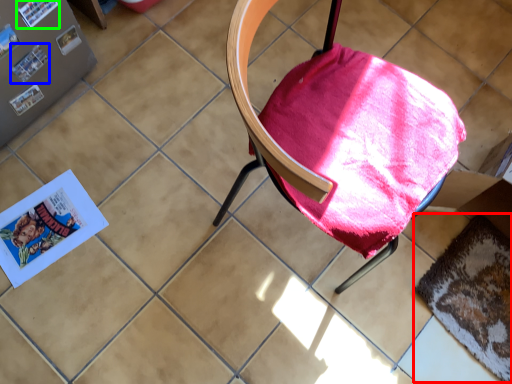
Question: Which object is the farthest from mat (highlighted by a red box)? Choose among these: paperback book (highlighted by a blue box) or paperback book (highlighted by a green box).

Choices:
 (A) paperback book
 (B) paperback book

Answer: (B)